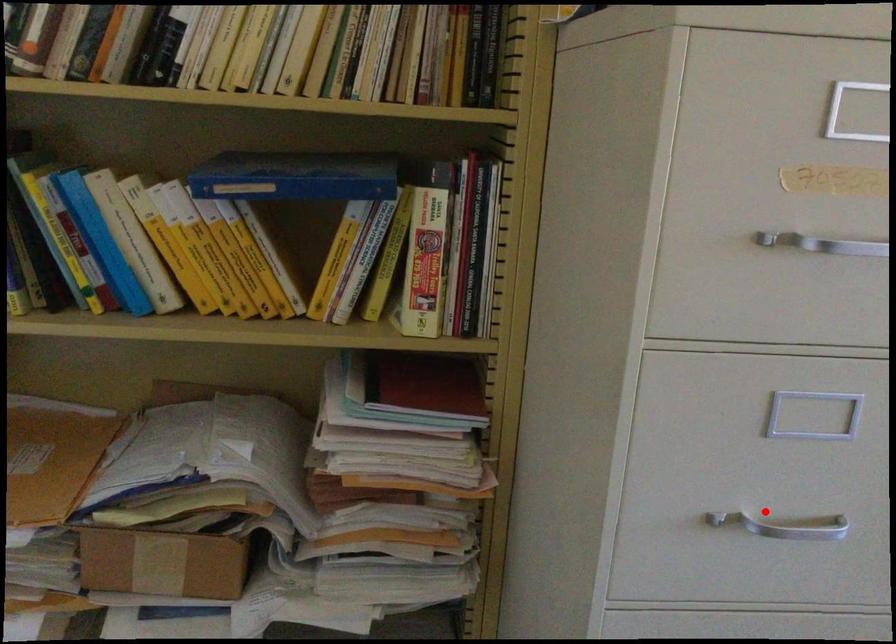
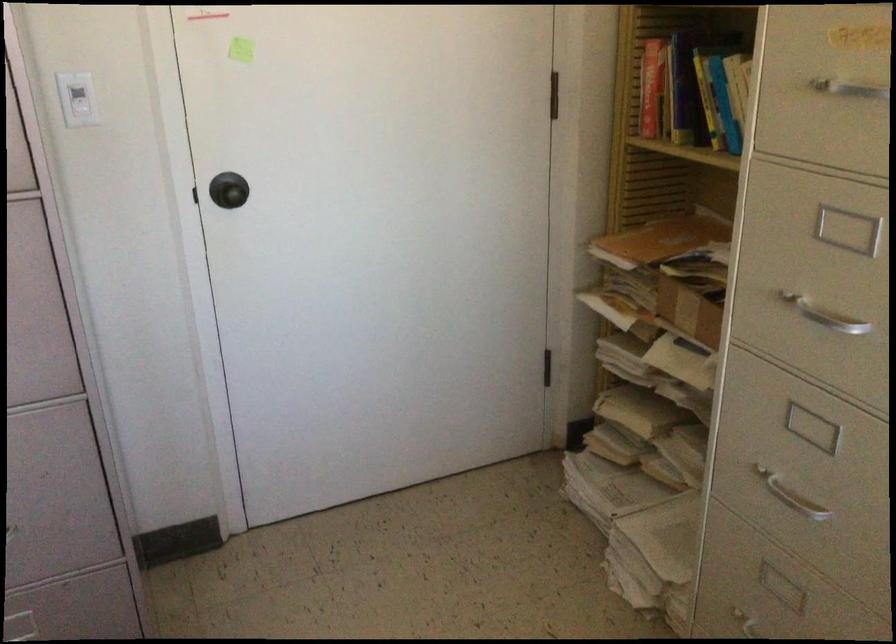
Question: I am providing you with two images of the same scene from different viewpoints. Image1 has a red point marked. In image2, the corresponding 3D location appears at what relative position? Reply with the corresponding letter.

Choices:
 (A) Closer
 (B) Farther

Answer: (B)